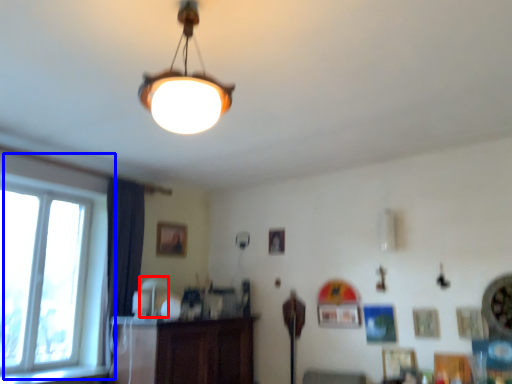
Question: Among these objects, which one is nearest to the camera, lamp (highlighted by a red box) or window (highlighted by a blue box)?

Choices:
 (A) lamp
 (B) window

Answer: (B)